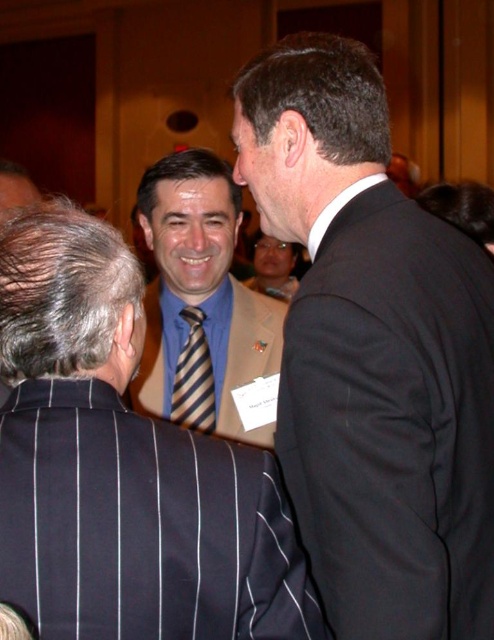
Is striped tie at center further to camera compared to striped fabric tie at center?

No, it is in front of striped fabric tie at center.

Find the location of `striped tie at center`. striped tie at center is located at coordinates (201, 300).

Is point (209, 163) positioned after point (200, 321)?

No, it is not.

Where is `striped tie at center`? This screenshot has width=494, height=640. striped tie at center is located at coordinates (201, 300).

Is black suit at right further to the viewer compared to striped fabric tie at center?

No, it is in front of striped fabric tie at center.

Which is more to the left, black suit at right or striped fabric tie at center?

Positioned to the left is striped fabric tie at center.

Which is behind, point (439, 371) or point (191, 316)?

The point (191, 316) is behind.

Locate an element on the screen. The height and width of the screenshot is (640, 494). black suit at right is located at coordinates (373, 355).

Between black suit at right and blue striped tie at center, which one is positioned lower?

Positioned lower is blue striped tie at center.

Locate an element on the screen. black suit at right is located at coordinates (373, 355).

You are a GUI agent. You are given a task and a screenshot of the screen. Output one action in this format:
    pyautogui.click(x=<x>, y=<y>)
    Task: Click on the black suit at right
    
    Given the screenshot: What is the action you would take?
    pyautogui.click(x=373, y=355)